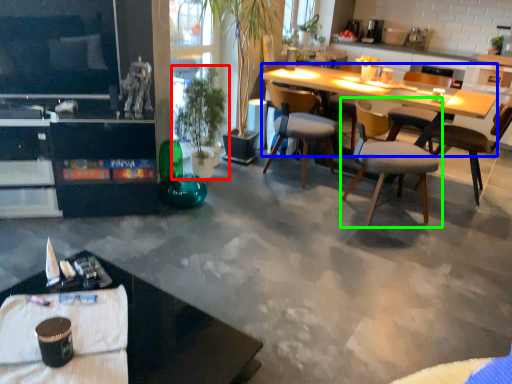
Question: Estimate the real-world distances between objects in this image. Which object is farther from houseplant (highlighted by a red box), kitchen & dining room table (highlighted by a blue box) or chair (highlighted by a green box)?

Choices:
 (A) kitchen & dining room table
 (B) chair

Answer: (B)